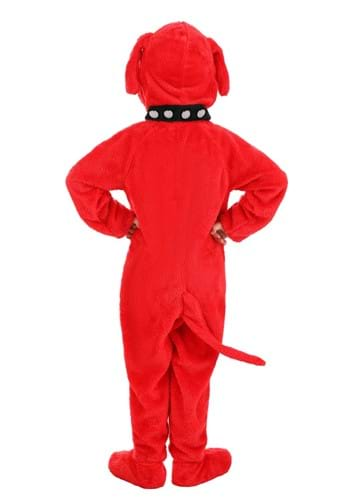
Locate an element on the screen. Image resolution: width=350 pixels, height=500 pixels. hood is located at coordinates (177, 75).